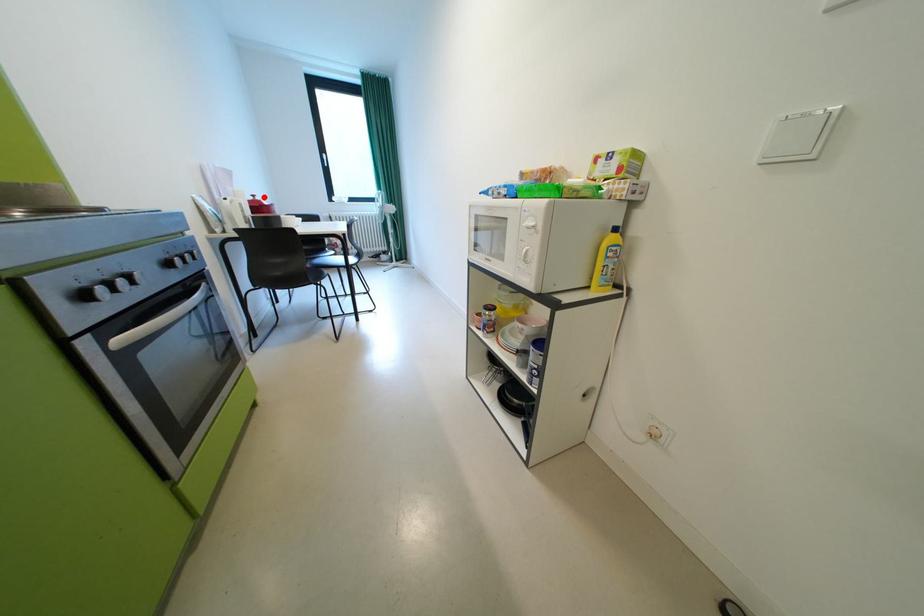
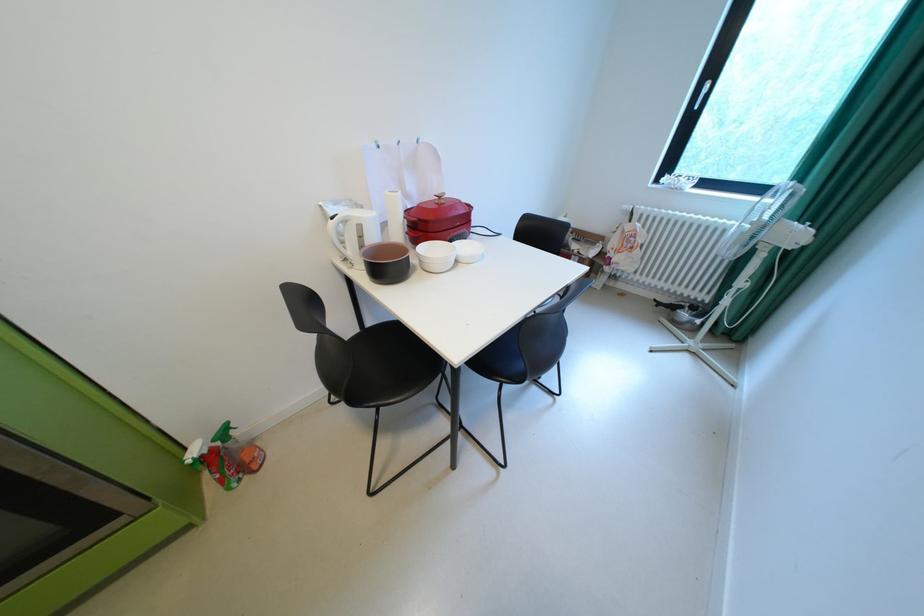
In the second image, find the point that corresponds to the highlighted location in the first image.

(450, 198)